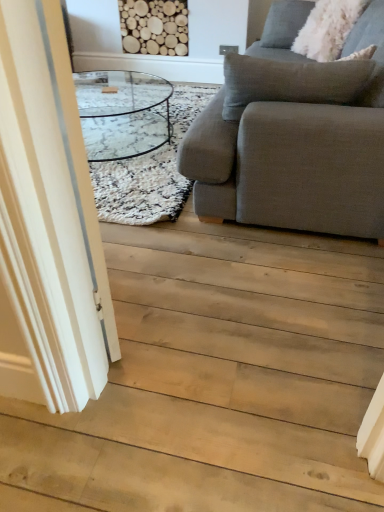
At what (x,y) coordinates should I click in order to perform the action: click on vacant area on top of white shaggy rug at center (from a real-world perspective). Please return your answer as a coordinate pair (x, y). The width and height of the screenshot is (384, 512). Looking at the image, I should click on (141, 124).